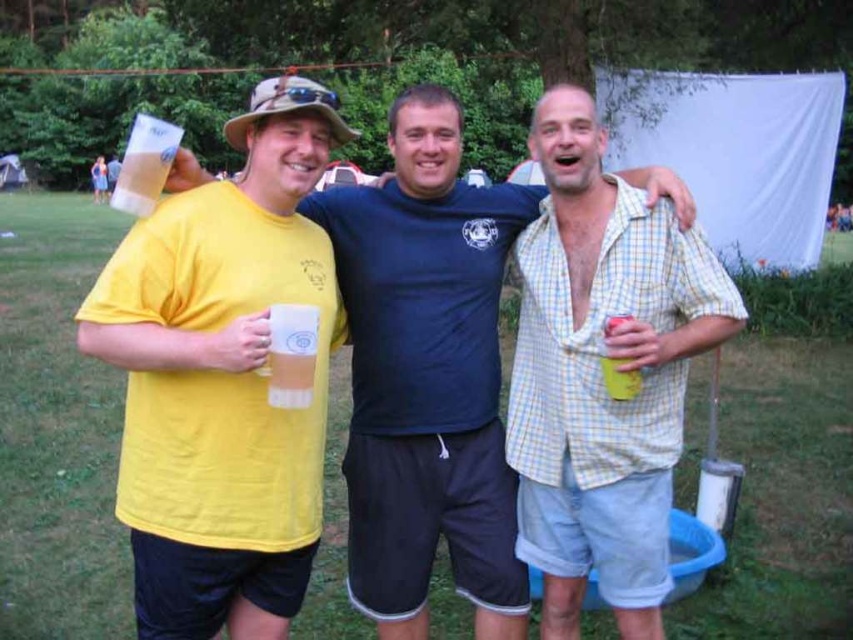
You are taking a photo of two points in the scene. The first point is at coordinate point(299, 392) and the second is at point(608, 321). Which point will appear larger in your photo?

Point(299, 392) is closer to the camera than point(608, 321), so it will appear larger in the photo.